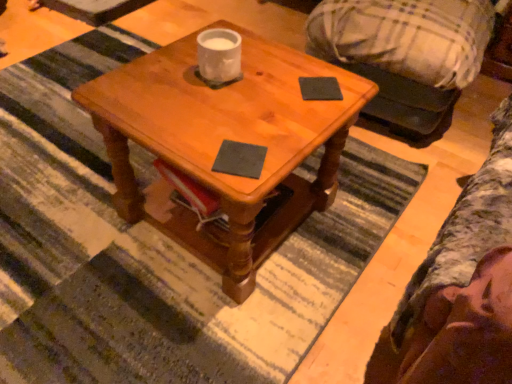
Question: From a real-world perspective, does dark gray matte notepad at center, which is the 1th notepad from bottom to top, stand above wooden coffee table at center?

Choices:
 (A) yes
 (B) no

Answer: (A)

Question: From the image's perspective, is dark gray matte notepad at center, the 1th notepad in the front-to-back sequence, beneath wooden coffee table at center?

Choices:
 (A) no
 (B) yes

Answer: (B)

Question: Is dark gray matte notepad at center, the first notepad positioned from the left, smaller than wooden coffee table at center?

Choices:
 (A) yes
 (B) no

Answer: (A)

Question: Is wooden coffee table at center inside dark gray matte notepad at center, which is counted as the second notepad, starting from the back?

Choices:
 (A) no
 (B) yes

Answer: (A)

Question: Is dark gray matte notepad at center, which is counted as the second notepad, starting from the back, to the left of wooden coffee table at center from the viewer's perspective?

Choices:
 (A) no
 (B) yes

Answer: (A)

Question: Looking at their shapes, would you say wooden coffee table at center is wider or thinner than black matte notepad at upper right, positioned as the first notepad in top-to-bottom order?

Choices:
 (A) wide
 (B) thin

Answer: (A)

Question: Is wooden coffee table at center bigger or smaller than black matte notepad at upper right, placed as the 2th notepad when sorted from left to right?

Choices:
 (A) big
 (B) small

Answer: (A)

Question: From a real-world perspective, is wooden coffee table at center positioned above or below black matte notepad at upper right, placed as the second notepad when sorted from bottom to top?

Choices:
 (A) below
 (B) above

Answer: (A)

Question: From the image's perspective, is wooden coffee table at center above or below black matte notepad at upper right, placed as the second notepad when sorted from bottom to top?

Choices:
 (A) below
 (B) above

Answer: (A)

Question: Relative to dark gray matte notepad at center, which is counted as the second notepad, starting from the back, is wooden coffee table at center in front or behind?

Choices:
 (A) behind
 (B) front

Answer: (B)

Question: From the image's perspective, relative to dark gray matte notepad at center, which is counted as the second notepad, starting from the back, is wooden coffee table at center above or below?

Choices:
 (A) above
 (B) below

Answer: (A)

Question: Visually, is wooden coffee table at center positioned to the left or to the right of dark gray matte notepad at center, acting as the second notepad starting from the right?

Choices:
 (A) right
 (B) left

Answer: (B)

Question: In terms of size, does wooden coffee table at center appear bigger or smaller than dark gray matte notepad at center, the 1th notepad in the front-to-back sequence?

Choices:
 (A) big
 (B) small

Answer: (A)

Question: Is black matte notepad at upper right, positioned as the first notepad in top-to-bottom order, in front of or behind wooden coffee table at center in the image?

Choices:
 (A) front
 (B) behind

Answer: (B)

Question: From a real-world perspective, relative to wooden coffee table at center, is black matte notepad at upper right, which appears as the first notepad when viewed from the right, vertically above or below?

Choices:
 (A) below
 (B) above

Answer: (B)